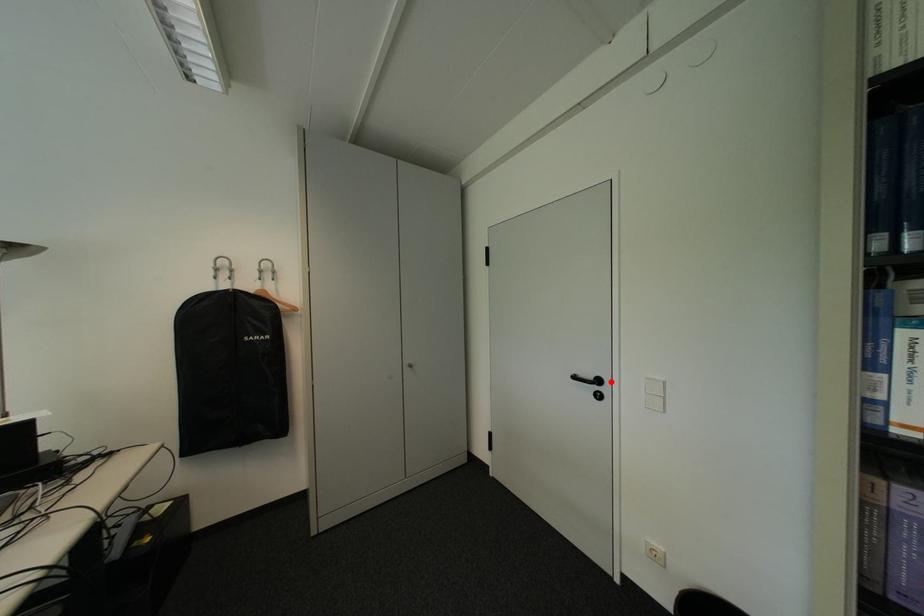
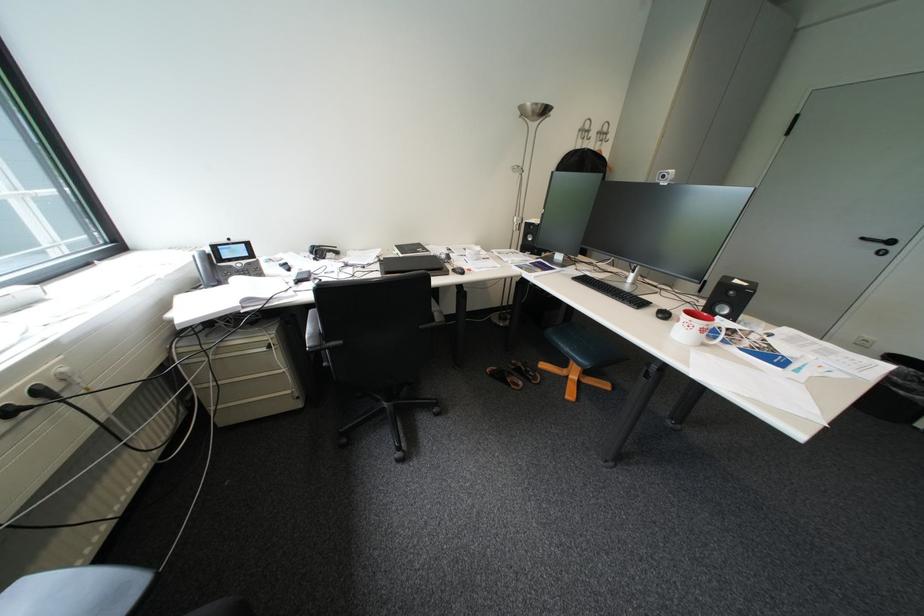
Question: I am providing you with two images of the same scene from different viewpoints. Image1 has a red point marked. In image2, the corresponding 3D location appears at what relative position? Reply with the corresponding letter.

Choices:
 (A) Closer
 (B) Farther

Answer: (B)